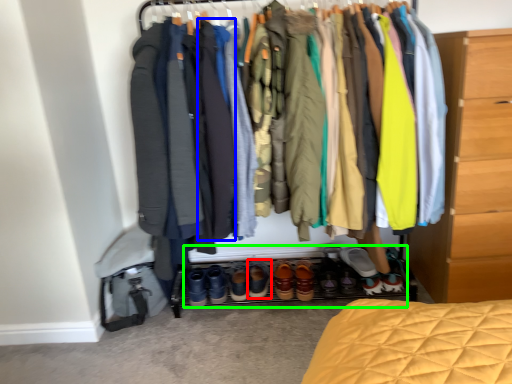
Question: Which object is positioned closest to footwear (highlighted by a red box)? Select from robe (highlighted by a blue box) and footwear (highlighted by a green box).

Choices:
 (A) robe
 (B) footwear

Answer: (B)